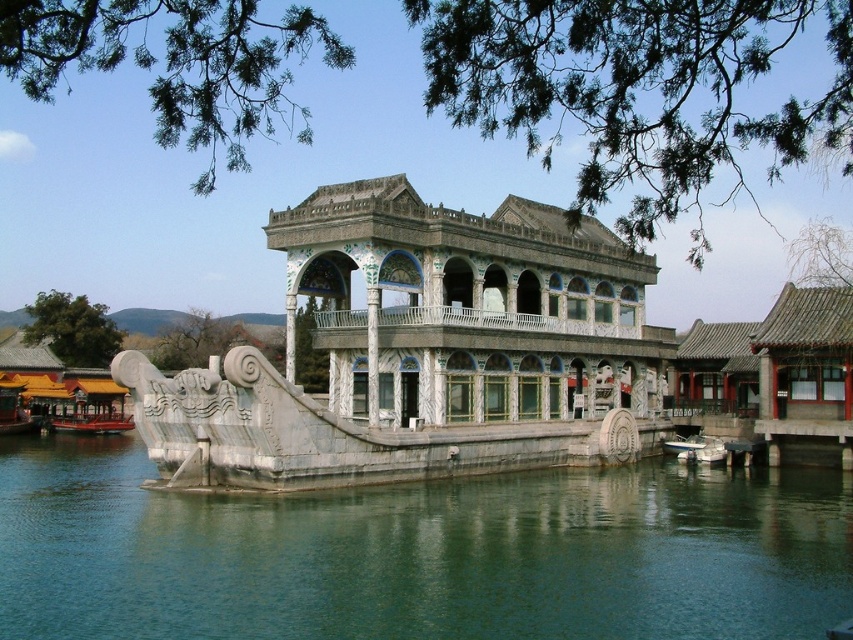
Between green stone water at center and white marble palace at center, which one is positioned higher?

white marble palace at center

Does green stone water at center have a smaller size compared to white marble palace at center?

Yes.

At what (x,y) coordinates should I click in order to perform the action: click on green stone water at center. Please return your answer as a coordinate pair (x, y). This screenshot has height=640, width=853. Looking at the image, I should click on (419, 554).

Is the position of white marble palace at center less distant than that of shiny red boat at lower left?

Yes, white marble palace at center is closer to the viewer.

Can you confirm if white marble palace at center is smaller than shiny red boat at lower left?

Incorrect, white marble palace at center is not smaller in size than shiny red boat at lower left.

Is point (601, 225) farther from camera compared to point (90, 432)?

That is False.

Identify the location of white marble palace at center. (469, 307).

Identify the location of green stone water at center. (419, 554).

Is point (606, 628) behind point (79, 419)?

That is False.

Which is in front, point (589, 557) or point (67, 419)?

Point (589, 557) is in front.

I want to click on green stone water at center, so click(x=419, y=554).